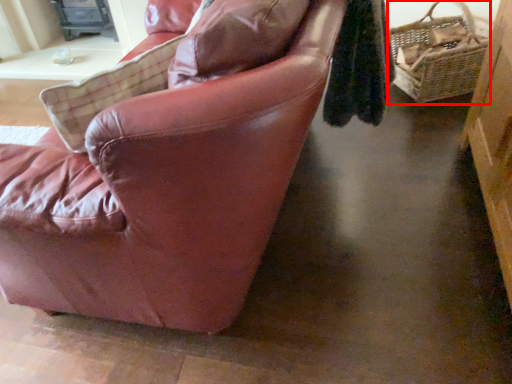
Question: From the image's perspective, where is picnic basket (annotated by the red box) located relative to chair?

Choices:
 (A) above
 (B) below

Answer: (A)